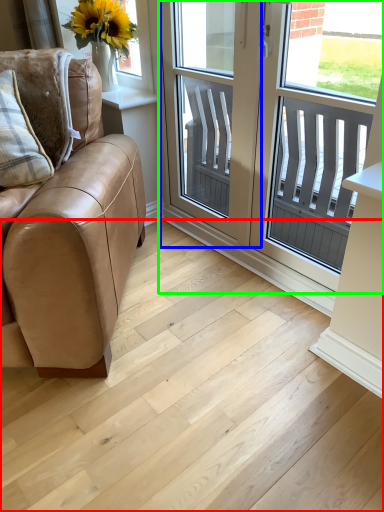
Question: Which is farther away from stairwell (highlighted by a red box)? screen door (highlighted by a blue box) or window (highlighted by a green box)?

Choices:
 (A) screen door
 (B) window

Answer: (B)